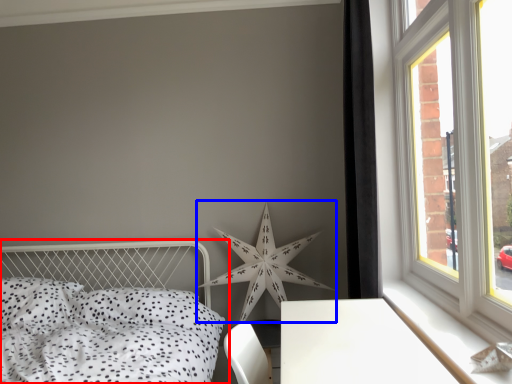
Question: Which object appears farthest to the camera in this image, bed (highlighted by a red box) or star (highlighted by a blue box)?

Choices:
 (A) bed
 (B) star

Answer: (B)